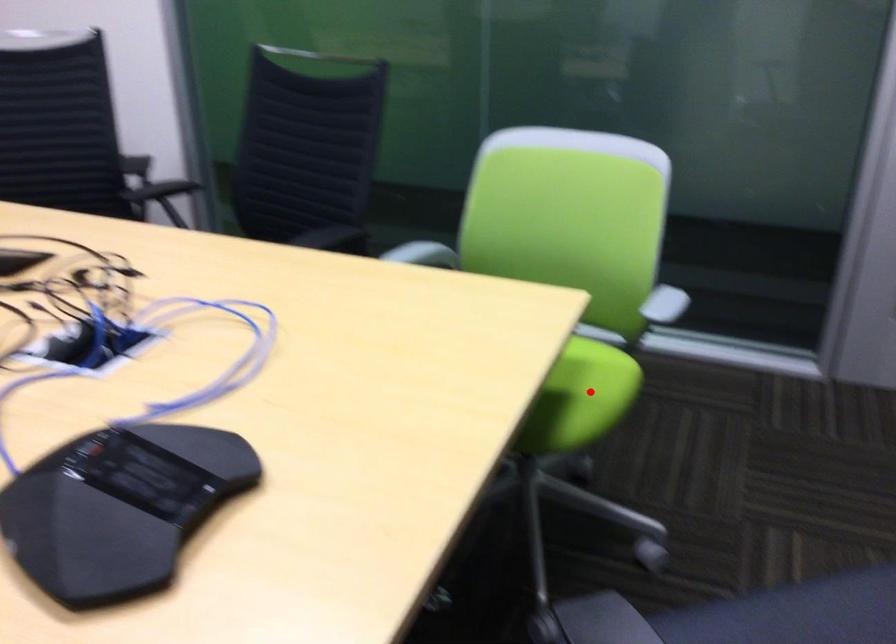
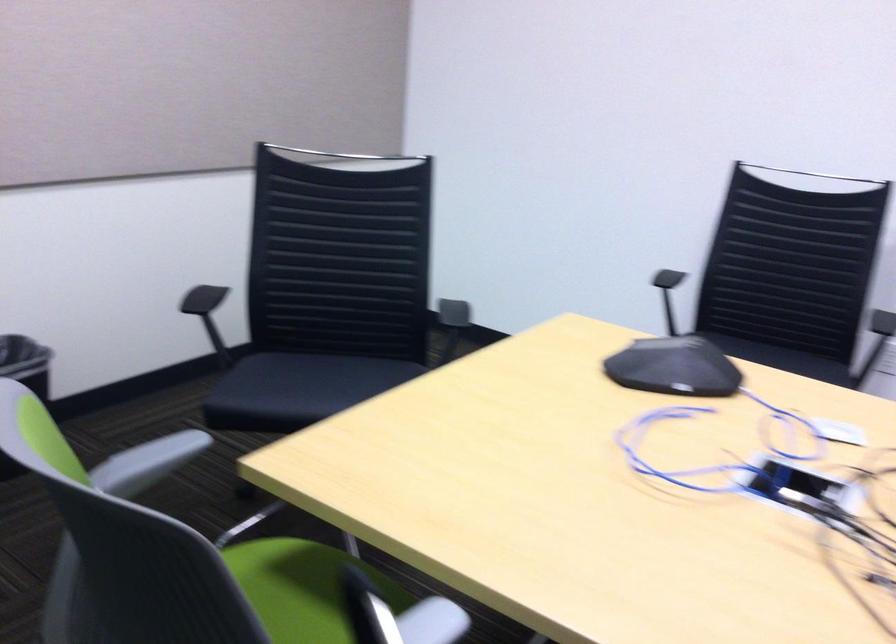
Question: I am providing you with two images of the same scene from different viewpoints. A red point is marked on the first image. Is the red point's position out of view in image 2?

Choices:
 (A) Yes
 (B) No

Answer: (A)